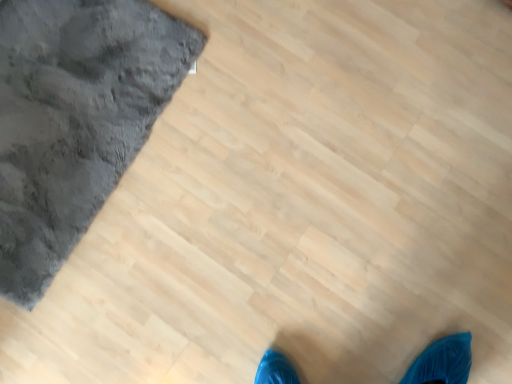
Question: Should I look upward or downward to see dark gray plush bath mat at upper left?

Choices:
 (A) down
 (B) up

Answer: (B)